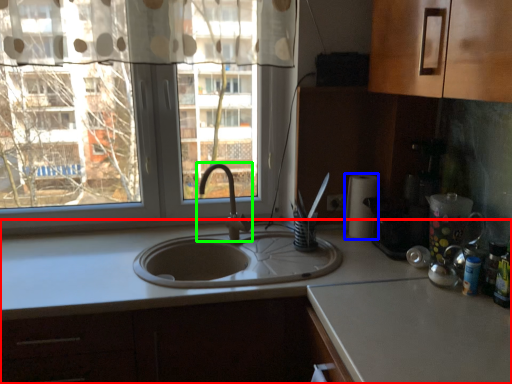
Question: Which object is the closest to the countertop (highlighted by a red box)? Choose among these: paper towel (highlighted by a blue box) or tap (highlighted by a green box).

Choices:
 (A) paper towel
 (B) tap

Answer: (A)